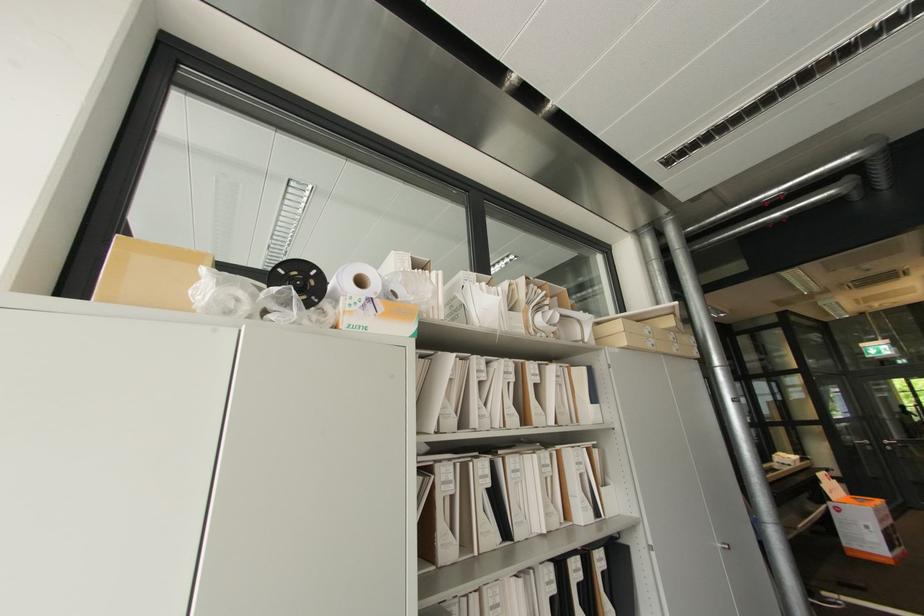
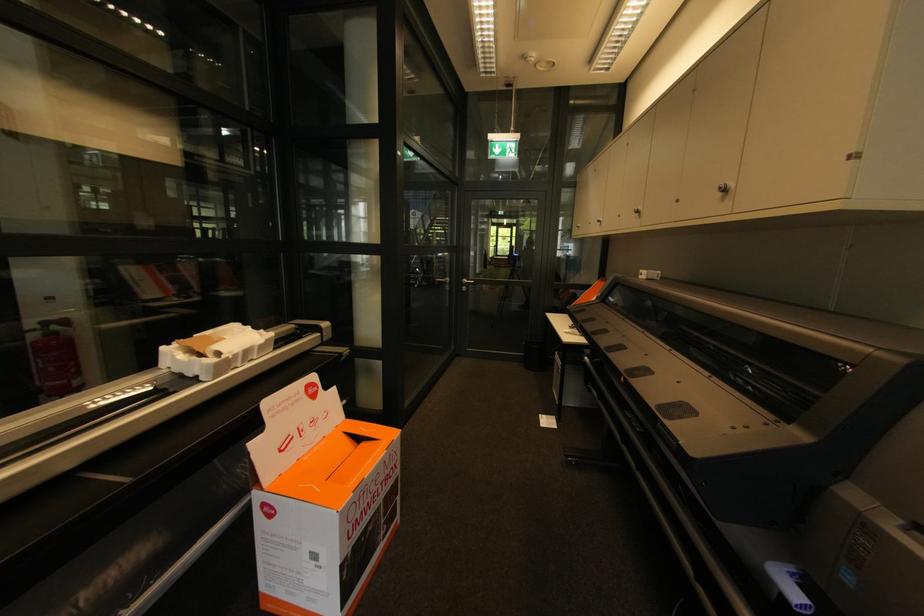
In the second image, find the point that corresponds to point (791, 464) in the first image.

(195, 376)